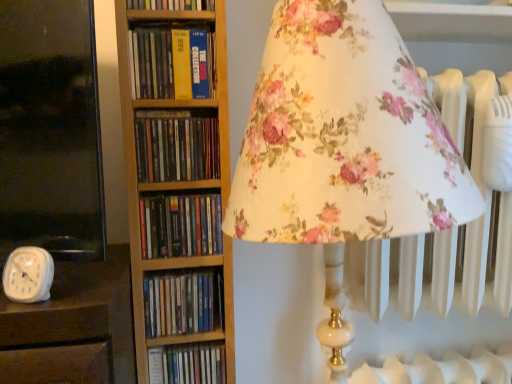
Question: Which is correct: yellow hardcover book at center, positioned as the 5th book in bottom-to-top order, is inside hardcover book at center, placed as the 4th book when sorted from top to bottom, or outside of it?

Choices:
 (A) outside
 (B) inside

Answer: (A)

Question: Is yellow hardcover book at center, which appears as the second book when viewed from the top, to the left or to the right of hardcover book at center, placed as the 4th book when sorted from top to bottom, in the image?

Choices:
 (A) right
 (B) left

Answer: (B)

Question: Which is nearer to the blue hardcover book at center, positioned as the 2th book in bottom-to-top order?

Choices:
 (A) hardcover book at center, which ranks as the third book in bottom-to-top order
 (B) hardcover book at center, acting as the first book starting from the bottom
 (C) hardcover books at center, the fourth book ordered from the bottom
 (D) hardcover book at upper center, which is the 6th book in bottom-to-top order
 (E) white plastic clock at lower left

Answer: (B)

Question: Which object is positioned closest to the yellow hardcover book at center, positioned as the 5th book in bottom-to-top order?

Choices:
 (A) hardcover book at center, placed as the 4th book when sorted from top to bottom
 (B) hardcover book at upper center, which is the 6th book in bottom-to-top order
 (C) blue hardcover book at center, which ranks as the fifth book in top-to-bottom order
 (D) white plastic clock at lower left
 (E) hardcover book at center, marked as the 6th book in a top-to-bottom arrangement

Answer: (B)